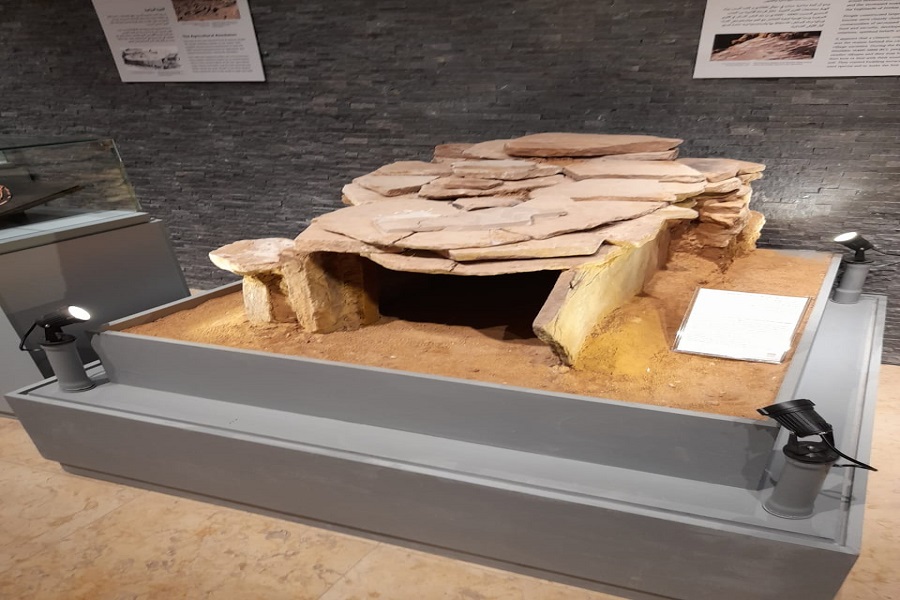
Locate an element on the screen. light stands is located at coordinates (789, 499), (856, 283), (76, 377).